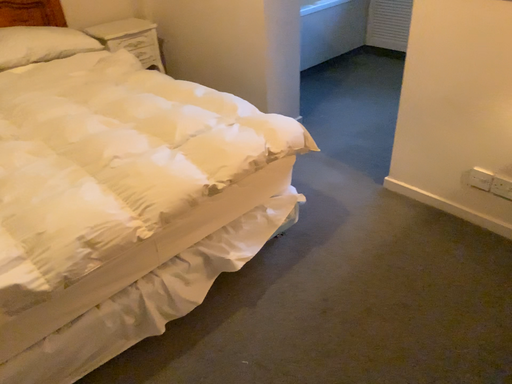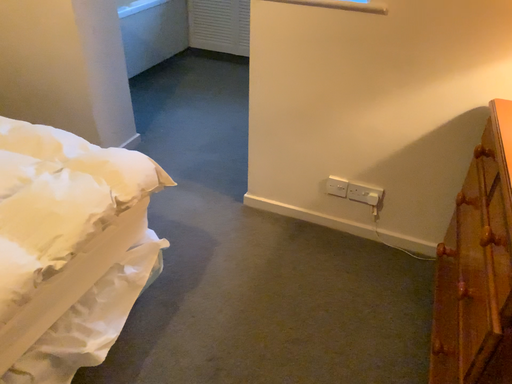
Question: How did the camera likely rotate when shooting the video?

Choices:
 (A) rotated left
 (B) rotated right

Answer: (B)